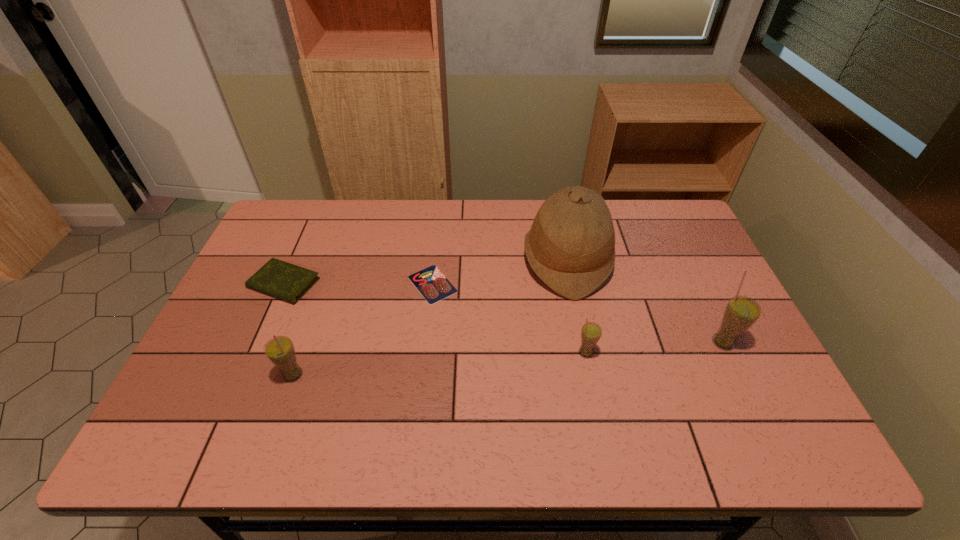
You are a GUI agent. You are given a task and a screenshot of the screen. Output one action in this format:
    pyautogui.click(x=<x>, y=<y>)
    Task: Click on the vacant space that satisfies the following two spatial constraints: 1. on the front-facing side of the tallest object; 2. on the back side of the fourth tallest object
    
    Given the screenshot: What is the action you would take?
    pyautogui.click(x=586, y=353)

Where is `vacant area in the image that satisfies the following two spatial constraints: 1. on the front-facing side of the tallest object; 2. on the left side of the second straw for drinking from left to right`? vacant area in the image that satisfies the following two spatial constraints: 1. on the front-facing side of the tallest object; 2. on the left side of the second straw for drinking from left to right is located at coordinates (586, 353).

Identify the location of vacant space that satisfies the following two spatial constraints: 1. on the front side of the third object from left to right; 2. on the left side of the shortest straw for drinking. (425, 353).